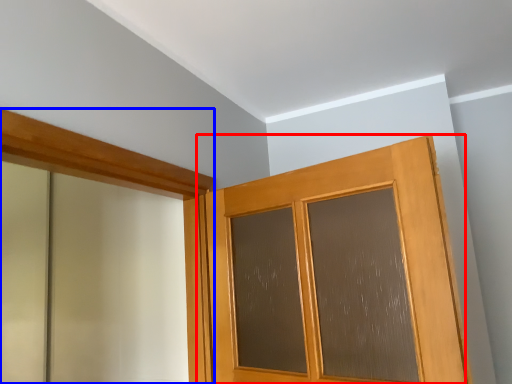
Question: Which object appears closest to the camera in this image, door (highlighted by a red box) or barn door (highlighted by a blue box)?

Choices:
 (A) door
 (B) barn door

Answer: (B)